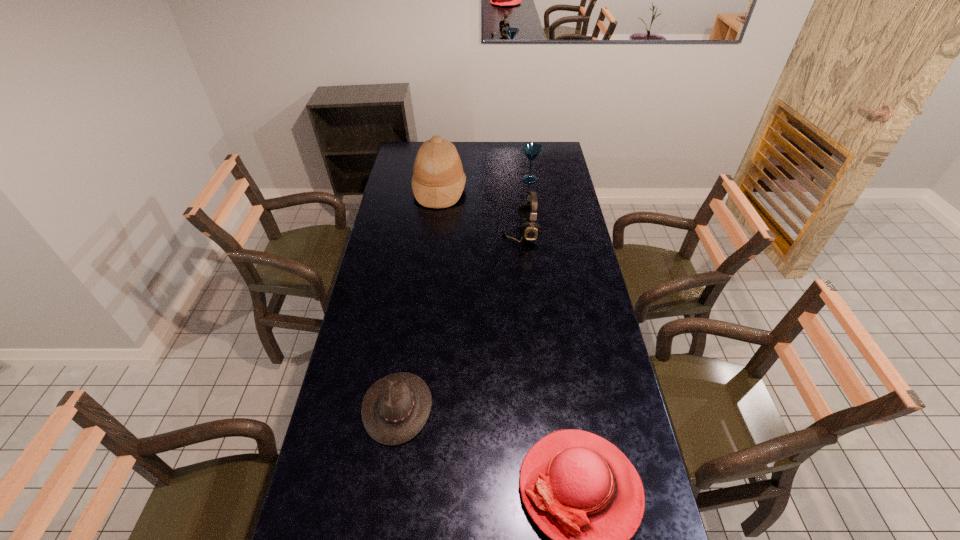
You are a GUI agent. You are given a task and a screenshot of the screen. Output one action in this format:
    pyautogui.click(x=<x>, y=<y>)
    Task: Click on the third closest hat relative to the headset
    
    Given the screenshot: What is the action you would take?
    (x=583, y=492)

Where is `hat object that ranks as the second closest to the farthest hat`? This screenshot has width=960, height=540. hat object that ranks as the second closest to the farthest hat is located at coordinates (583, 492).